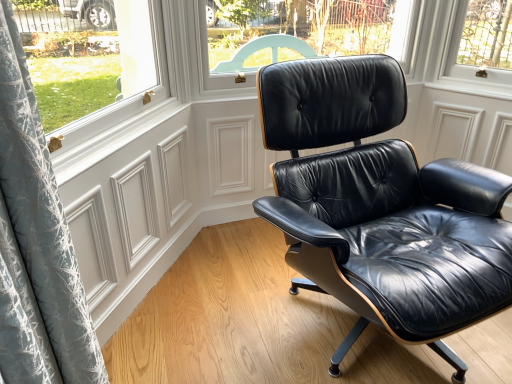
This screenshot has width=512, height=384. What do you see at coordinates (380, 206) in the screenshot? I see `black leather chair at center` at bounding box center [380, 206].

What is the approximate height of black leather chair at center?

It is 32.97 inches.

You are a GUI agent. You are given a task and a screenshot of the screen. Output one action in this format:
    pyautogui.click(x=<x>, y=<y>)
    Task: Click on the black leather chair at center
    This screenshot has width=512, height=384.
    Given the screenshot: What is the action you would take?
    pyautogui.click(x=380, y=206)

What do you see at coordinates (132, 210) in the screenshot? This screenshot has width=512, height=384. I see `white matte screen door at lower left` at bounding box center [132, 210].

Image resolution: width=512 pixels, height=384 pixels. Find the location of `white matte screen door at lower left`. white matte screen door at lower left is located at coordinates (132, 210).

Find the location of a particular element. The width and height of the screenshot is (512, 384). black leather chair at center is located at coordinates (380, 206).

Which object is positioned more to the left, white matte screen door at lower left or black leather chair at center?

Positioned to the left is white matte screen door at lower left.

Is white matte screen door at lower left positioned in front of black leather chair at center?

No, white matte screen door at lower left is behind black leather chair at center.

Considering the points (133, 131) and (393, 110), which point is in front, point (133, 131) or point (393, 110)?

The point (133, 131) is closer.

From the image's perspective, would you say white matte screen door at lower left is positioned over black leather chair at center?

Actually, white matte screen door at lower left appears below black leather chair at center in the image.

From a real-world perspective, which is physically below, white matte screen door at lower left or black leather chair at center?

In real-world perspective, white matte screen door at lower left is lower.

Which of these two, white matte screen door at lower left or black leather chair at center, is wider?

black leather chair at center.

From their relative heights in the image, would you say white matte screen door at lower left is taller or shorter than black leather chair at center?

Considering their sizes, white matte screen door at lower left has less height than black leather chair at center.

Between white matte screen door at lower left and black leather chair at center, which one has smaller size?

With smaller size is white matte screen door at lower left.

Would you say white matte screen door at lower left is inside or outside black leather chair at center?

white matte screen door at lower left is not inside black leather chair at center, it's outside.

Is white matte screen door at lower left far away from black leather chair at center?

No, white matte screen door at lower left is in close proximity to black leather chair at center.

Does white matte screen door at lower left turn towards black leather chair at center?

Yes, white matte screen door at lower left is turned towards black leather chair at center.

How many degrees apart are the facing directions of white matte screen door at lower left and black leather chair at center?

47.3 degrees separate the facing orientations of white matte screen door at lower left and black leather chair at center.

The image size is (512, 384). In order to click on chair on the right of white matte screen door at lower left in this screenshot , I will do `click(380, 206)`.

Considering the positions of objects black leather chair at center and white matte screen door at lower left in the image provided, who is more to the right, black leather chair at center or white matte screen door at lower left?

Positioned to the right is black leather chair at center.

Is black leather chair at center in front of or behind white matte screen door at lower left in the image?

black leather chair at center is positioned closer to the viewer than white matte screen door at lower left.

Which point is more forward, (344, 177) or (129, 220)?

Positioned in front is point (129, 220).

From the image's perspective, which is below, black leather chair at center or white matte screen door at lower left?

white matte screen door at lower left.

From a real-world perspective, relative to white matte screen door at lower left, is black leather chair at center vertically above or below?

black leather chair at center is situated higher than white matte screen door at lower left in the real world.

Considering the relative sizes of black leather chair at center and white matte screen door at lower left in the image provided, is black leather chair at center wider than white matte screen door at lower left?

Yes.

Can you confirm if black leather chair at center is taller than white matte screen door at lower left?

Yes.

Between black leather chair at center and white matte screen door at lower left, which one has smaller size?

With smaller size is white matte screen door at lower left.

Does black leather chair at center contain white matte screen door at lower left?

No, white matte screen door at lower left is not a part of black leather chair at center.

Is black leather chair at center touching white matte screen door at lower left?

No, black leather chair at center is not in contact with white matte screen door at lower left.

Is black leather chair at center facing towards white matte screen door at lower left?

No, black leather chair at center is not aimed at white matte screen door at lower left.

Find the location of a particular element. The image size is (512, 384). screen door located below the black leather chair at center (from the image's perspective) is located at coordinates (132, 210).

You are a GUI agent. You are given a task and a screenshot of the screen. Output one action in this format:
    pyautogui.click(x=<x>, y=<y>)
    Task: Click on the screen door to the left of black leather chair at center
    
    Given the screenshot: What is the action you would take?
    pyautogui.click(x=132, y=210)

Where is `screen door below the black leather chair at center (from the image's perspective)`? This screenshot has height=384, width=512. screen door below the black leather chair at center (from the image's perspective) is located at coordinates (132, 210).